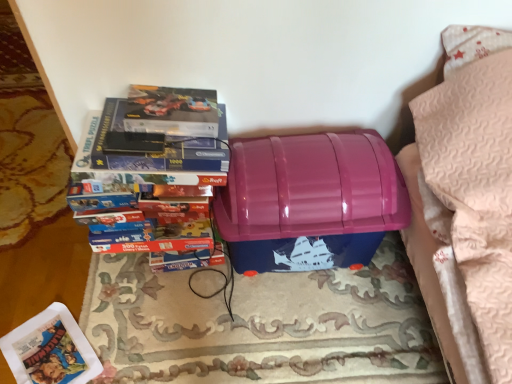
Question: From the image's perspective, is matte plastic paperback book at lower left above glossy plastic storage box at center?

Choices:
 (A) yes
 (B) no

Answer: (B)

Question: Is matte plastic paperback book at lower left positioned far away from glossy plastic storage box at center?

Choices:
 (A) no
 (B) yes

Answer: (A)

Question: Is matte plastic paperback book at lower left looking in the opposite direction of glossy plastic storage box at center?

Choices:
 (A) yes
 (B) no

Answer: (B)

Question: Considering the relative sizes of matte plastic paperback book at lower left and glossy plastic storage box at center in the image provided, is matte plastic paperback book at lower left thinner than glossy plastic storage box at center?

Choices:
 (A) no
 (B) yes

Answer: (B)

Question: From the image's perspective, would you say matte plastic paperback book at lower left is shown under glossy plastic storage box at center?

Choices:
 (A) no
 (B) yes

Answer: (B)

Question: Is the surface of matte plastic paperback book at lower left in direct contact with glossy plastic storage box at center?

Choices:
 (A) yes
 (B) no

Answer: (B)

Question: Would you say blue cardboard puzzle at left is a long distance from glossy plastic storage box at center?

Choices:
 (A) no
 (B) yes

Answer: (A)

Question: Is blue cardboard puzzle at left to the left of glossy plastic storage box at center from the viewer's perspective?

Choices:
 (A) no
 (B) yes

Answer: (B)

Question: Does blue cardboard puzzle at left lie behind glossy plastic storage box at center?

Choices:
 (A) yes
 (B) no

Answer: (B)

Question: Is blue cardboard puzzle at left shorter than glossy plastic storage box at center?

Choices:
 (A) yes
 (B) no

Answer: (B)

Question: Is blue cardboard puzzle at left bigger than glossy plastic storage box at center?

Choices:
 (A) yes
 (B) no

Answer: (B)

Question: Does blue cardboard puzzle at left have a lesser width compared to glossy plastic storage box at center?

Choices:
 (A) no
 (B) yes

Answer: (B)

Question: Could you tell me if matte plastic paperback book at lower left is facing rug/carpet at center?

Choices:
 (A) yes
 (B) no

Answer: (A)